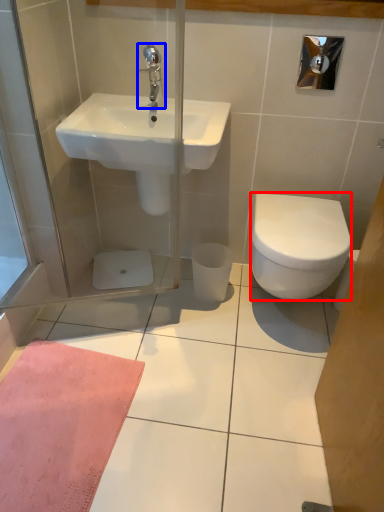
Question: Which object is closer to the camera taking this photo, bidet (highlighted by a red box) or tap (highlighted by a blue box)?

Choices:
 (A) bidet
 (B) tap

Answer: (A)